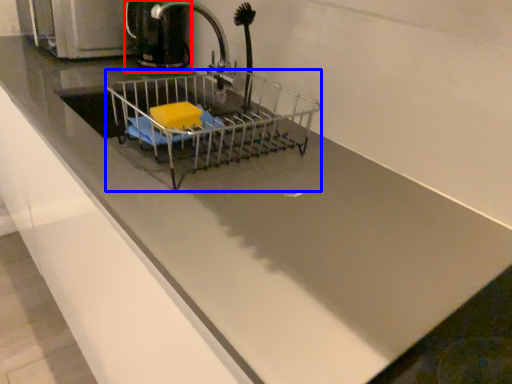
Question: Which of the following is the farthest to the observer, coffeepot (highlighted by a red box) or shopping cart (highlighted by a blue box)?

Choices:
 (A) coffeepot
 (B) shopping cart

Answer: (A)